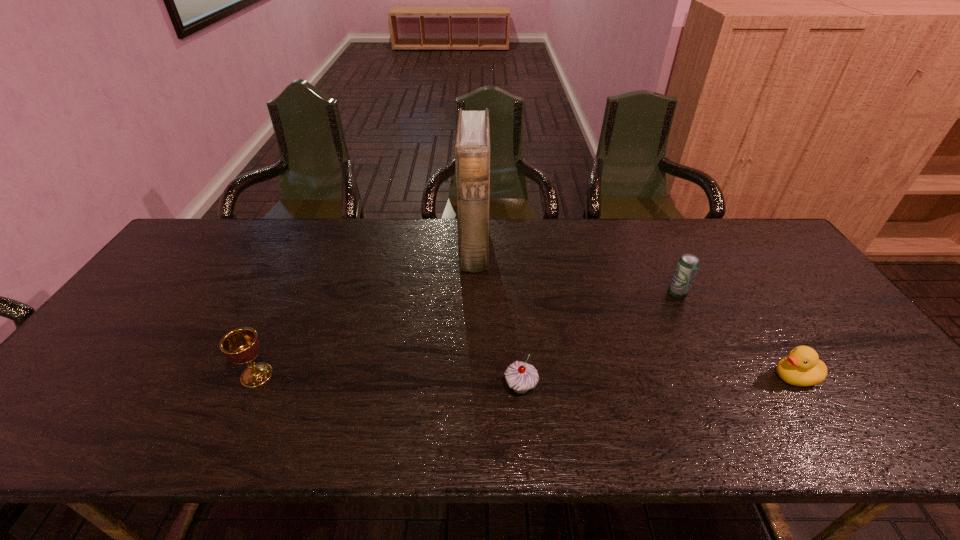
You are a GUI agent. You are given a task and a screenshot of the screen. Output one action in this format:
    pyautogui.click(x=<x>, y=<y>)
    Task: Click on the vacant space located 0.110m on the right of the chalice
    
    Given the screenshot: What is the action you would take?
    319,375

This screenshot has height=540, width=960. In order to click on vacant space located 0.250m on the left of the cupcake in this screenshot , I will do `click(396, 387)`.

I want to click on free space located on the face of the duckling, so click(635, 377).

Locate an element on the screen. The width and height of the screenshot is (960, 540). vacant space situated on the face of the duckling is located at coordinates (735, 377).

This screenshot has width=960, height=540. I want to click on vacant space located 0.090m on the face of the duckling, so click(735, 377).

The width and height of the screenshot is (960, 540). In order to click on object at the far edge in this screenshot , I will do pos(472,147).

What are the coordinates of `vacant point at the far edge` in the screenshot? It's located at (535, 256).

The height and width of the screenshot is (540, 960). Find the location of `free spot at the near edge of the desktop`. free spot at the near edge of the desktop is located at coordinates (610, 414).

Identify the location of free region at the left edge of the desktop. (125, 356).

You are a GUI agent. You are given a task and a screenshot of the screen. Output one action in this format:
    pyautogui.click(x=<x>, y=<y>)
    Task: Click on the vacant space at the right edge of the desktop
    The image size is (960, 540).
    Given the screenshot: What is the action you would take?
    pyautogui.click(x=798, y=318)